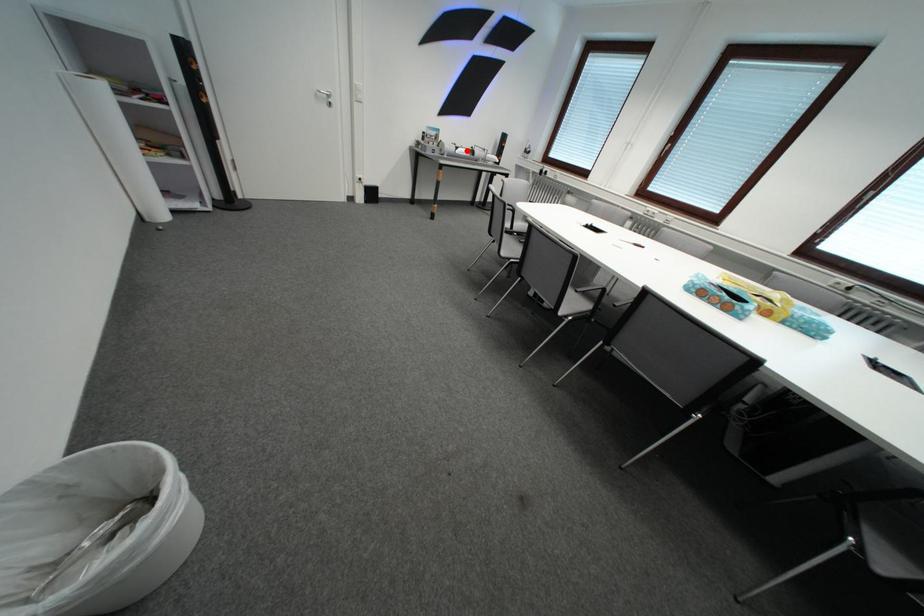
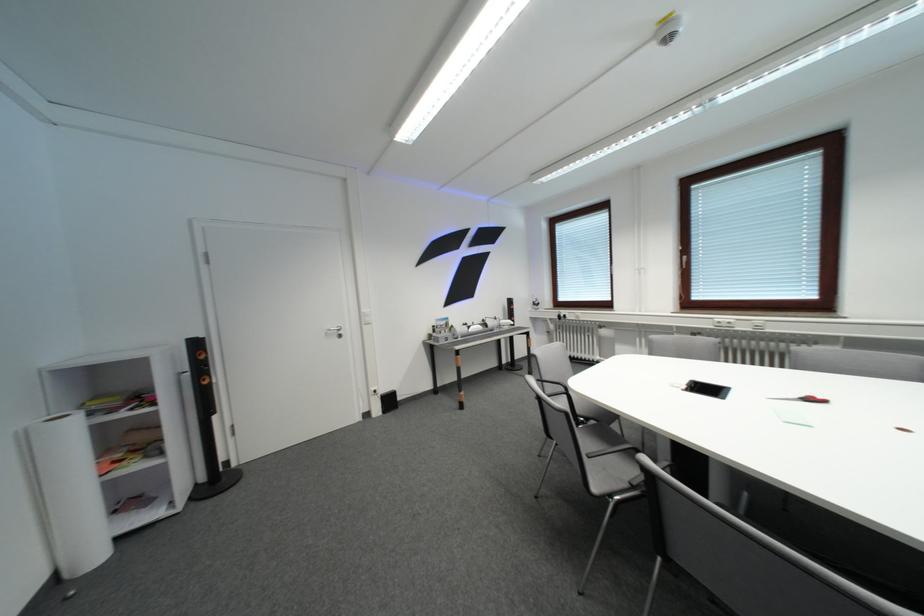
In the second image, find the point that corresponds to the highlighted location in the first image.

(479, 330)